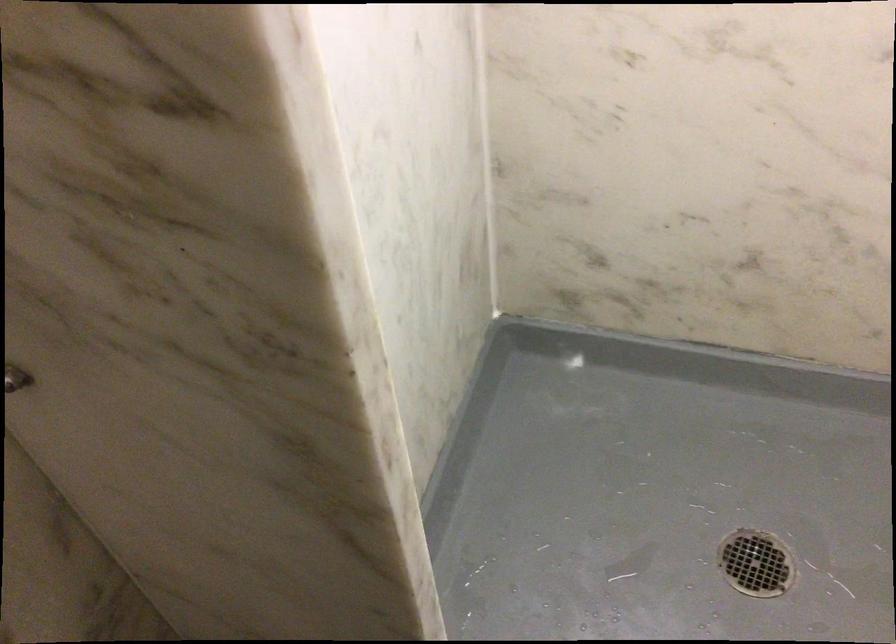
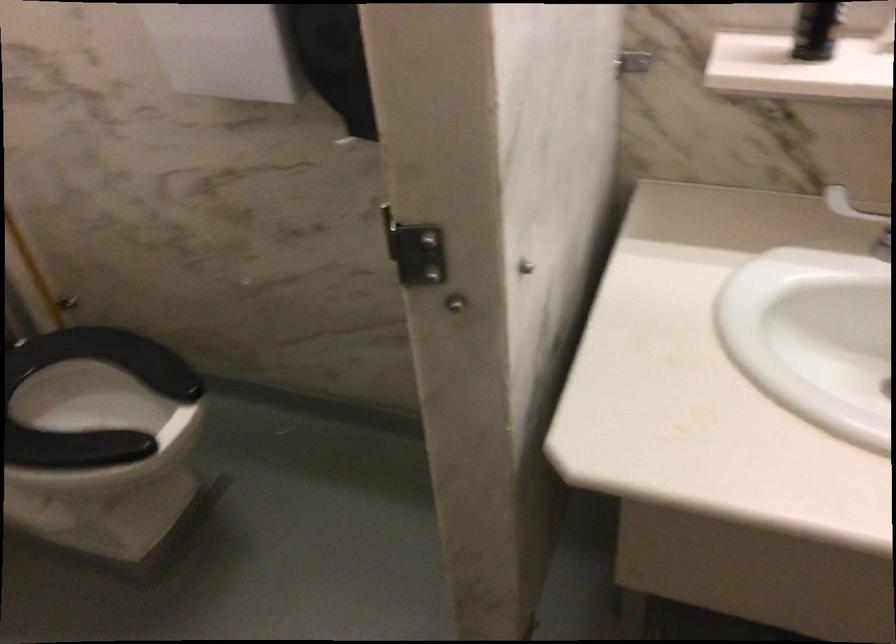
The images are taken continuously from a first-person perspective. In which direction is your viewpoint rotating?

The rotation direction of the camera is right-down.